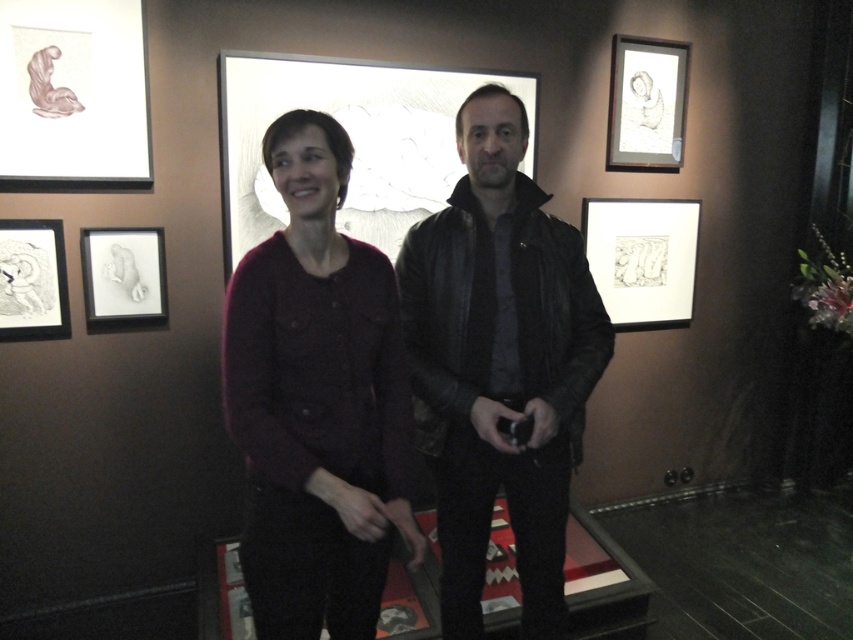
Question: From the image, what is the correct spatial relationship of leather jacket at center in relation to matte black picture frame at upper right?

Choices:
 (A) left
 (B) right

Answer: (A)

Question: Is matte purple sweater at center below white paper drawing at left?

Choices:
 (A) no
 (B) yes

Answer: (B)

Question: Which point is farther to the camera?

Choices:
 (A) matte glass picture frame at center
 (B) white paper drawing at left
 (C) black paper drawing at left
 (D) leather jacket at center

Answer: (A)

Question: Among these points, which one is farthest from the camera?

Choices:
 (A) coord(91,164)
 (B) coord(576,404)
 (C) coord(676,216)

Answer: (C)

Question: In this image, where is matte glass picture frame at center located relative to black matte picture frame at lower right?

Choices:
 (A) above
 (B) below

Answer: (A)

Question: Which object is closer to the camera taking this photo?

Choices:
 (A) leather jacket at center
 (B) black matte picture frame at lower right
 (C) black paper drawing at left
 (D) matte paper drawing at upper left

Answer: (A)